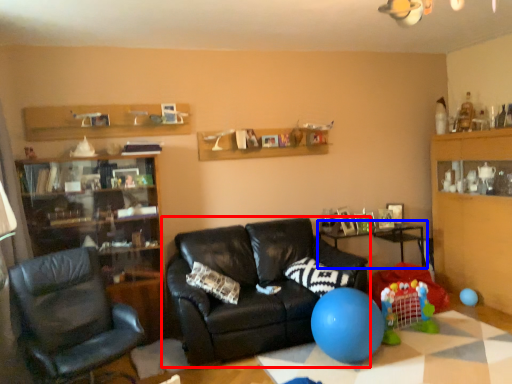
Question: Which object is closer to the camera taking this photo, studio couch (highlighted by a red box) or table (highlighted by a blue box)?

Choices:
 (A) studio couch
 (B) table

Answer: (A)